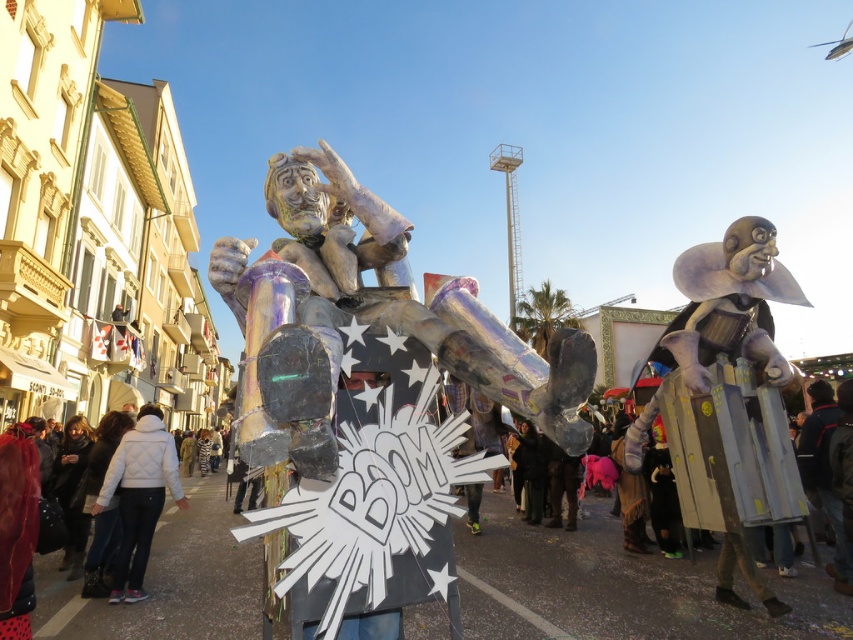
Who is positioned more to the right, iridescent metallic figure at center or white quilted jacket at lower left?

iridescent metallic figure at center is more to the right.

Does point (283, 432) come closer to viewer compared to point (144, 456)?

That is True.

Consider the image. Who is more distant from viewer, [432,316] or [140,538]?

Point [140,538]

Identify the location of iridescent metallic figure at center. The image size is (853, 640). (368, 317).